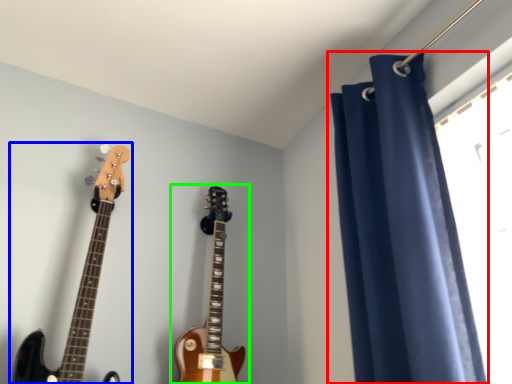
Question: Considering the real-world distances, which object is closest to curtain (highlighted by a red box)? guitar (highlighted by a blue box) or guitar (highlighted by a green box).

Choices:
 (A) guitar
 (B) guitar

Answer: (B)